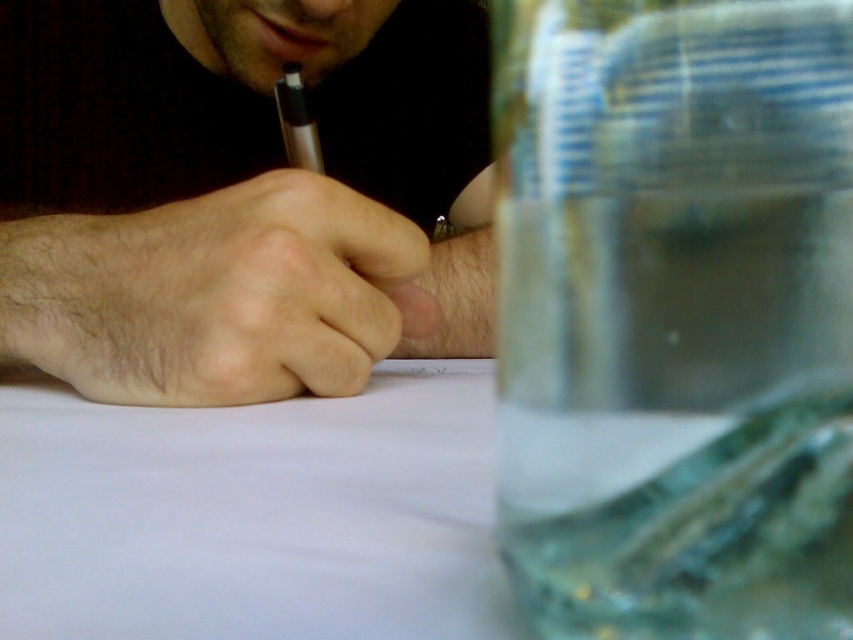
Can you confirm if white paper at center is taller than metallic gold pencil at center?

No.

Can you confirm if white paper at center is smaller than metallic gold pencil at center?

No.

Does point (369, 586) come behind point (302, 99)?

No.

At what (x,y) coordinates should I click in order to perform the action: click on white paper at center. Please return your answer as a coordinate pair (x, y). This screenshot has height=640, width=853. Looking at the image, I should click on (254, 513).

Who is higher up, transparent plastic jar at right or smooth skin hand at center?

Positioned higher is smooth skin hand at center.

Does transparent plastic jar at right have a greater width compared to smooth skin hand at center?

No, transparent plastic jar at right is not wider than smooth skin hand at center.

Who is more distant from viewer, (831,586) or (410,51)?

Positioned behind is point (410,51).

You are a GUI agent. You are given a task and a screenshot of the screen. Output one action in this format:
    pyautogui.click(x=<x>, y=<y>)
    Task: Click on the transparent plastic jar at right
    
    Given the screenshot: What is the action you would take?
    pyautogui.click(x=675, y=316)

Is transparent plastic jar at right to the left of white paper at center from the viewer's perspective?

No, transparent plastic jar at right is not to the left of white paper at center.

Is point (830, 26) closer to viewer compared to point (492, 604)?

Yes, it is.

What are the coordinates of `transparent plastic jar at right` in the screenshot? It's located at (675, 316).